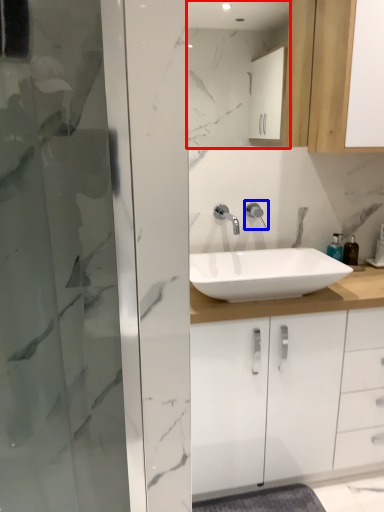
Question: Which object is closer to the camera taking this photo, mirror (highlighted by a red box) or tap (highlighted by a blue box)?

Choices:
 (A) mirror
 (B) tap

Answer: (A)